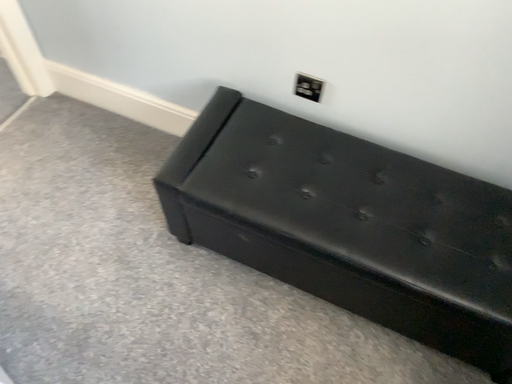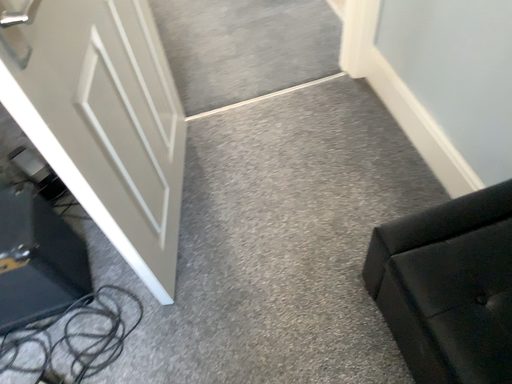
Question: How did the camera likely rotate when shooting the video?

Choices:
 (A) rotated left
 (B) rotated right

Answer: (A)